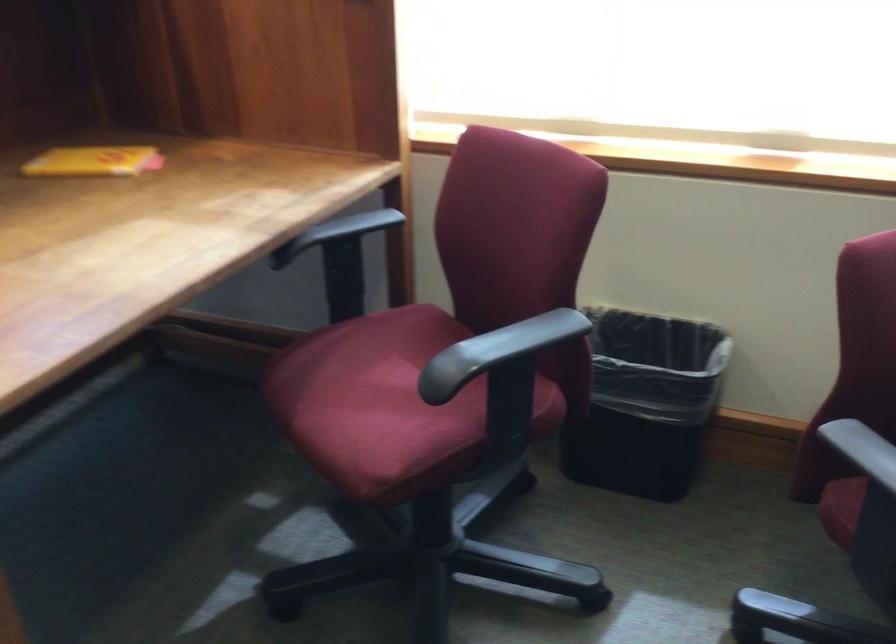
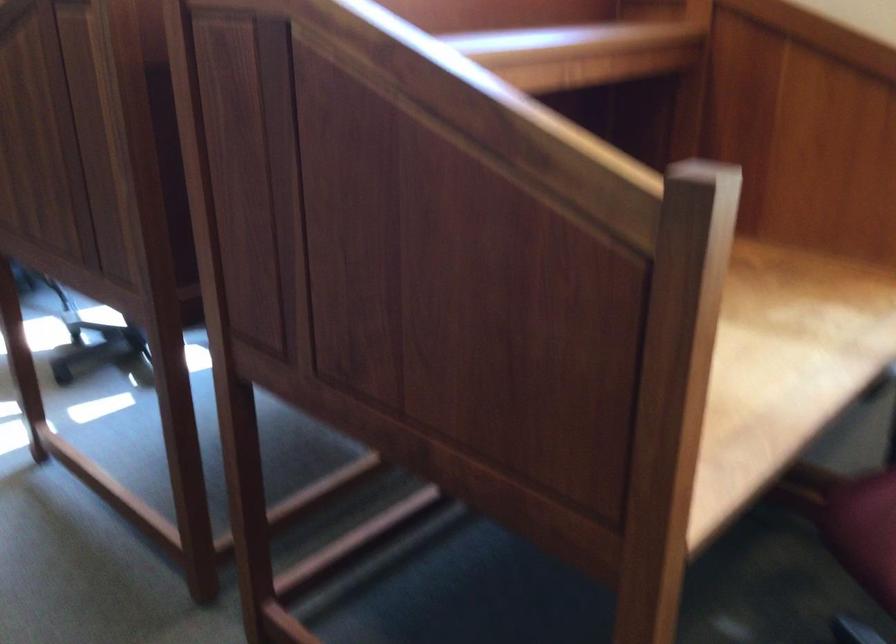
Question: The images are taken continuously from a first-person perspective. In which direction is your viewpoint rotating?

Choices:
 (A) Left
 (B) Right
 (C) Up
 (D) Down

Answer: (A)